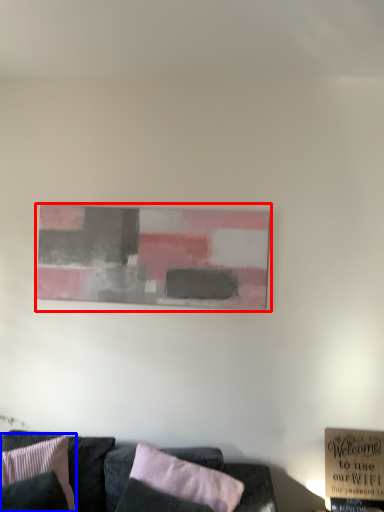
Question: Which object is closer to the camera taking this photo, picture frame (highlighted by a red box) or pillow (highlighted by a blue box)?

Choices:
 (A) picture frame
 (B) pillow

Answer: (B)